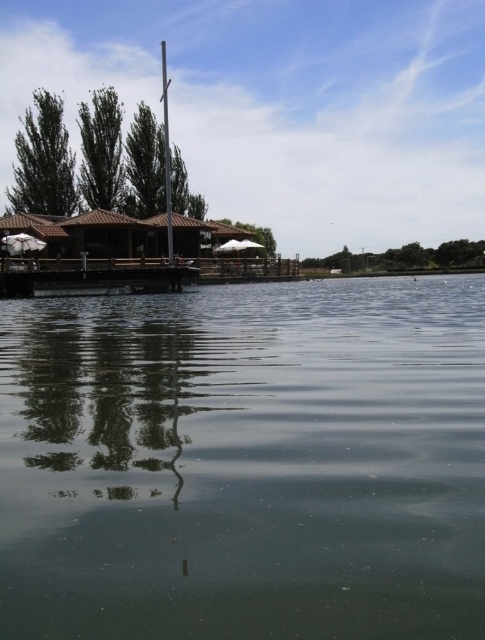
Does clear water at center have a greater width compared to smooth gray pole at center?

Correct, the width of clear water at center exceeds that of smooth gray pole at center.

Does point (16, 342) come farther from viewer compared to point (170, 189)?

No, (16, 342) is closer to viewer.

Where is `clear water at center`? clear water at center is located at coordinates (244, 461).

I want to click on clear water at center, so click(x=244, y=461).